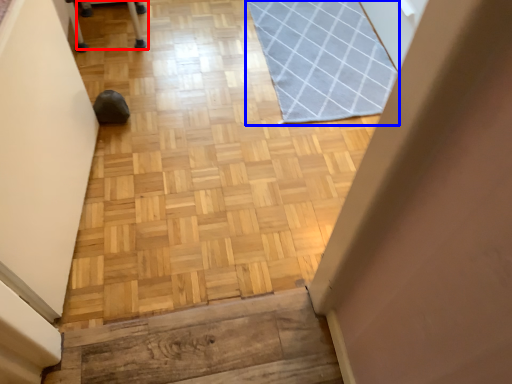
Question: Which object is further to the camera taking this photo, furniture (highlighted by a red box) or mat (highlighted by a blue box)?

Choices:
 (A) furniture
 (B) mat

Answer: (A)